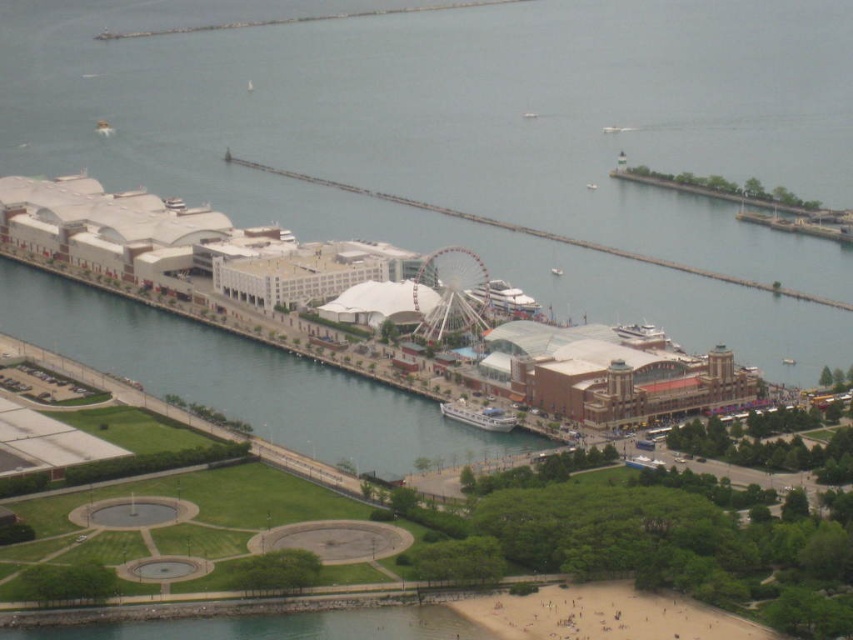
Question: Does green grass at lower center have a lesser width compared to white wooden boat at center?

Choices:
 (A) yes
 (B) no

Answer: (B)

Question: Which object is the closest to the green concrete river at center?

Choices:
 (A) white metallic ferris wheel at center
 (B) green grass at lower center
 (C) white wooden boat at center

Answer: (C)

Question: Is green concrete river at center thinner than white wooden boat at center?

Choices:
 (A) yes
 (B) no

Answer: (B)

Question: Which object is the closest to the white metallic ferris wheel at center?

Choices:
 (A) green grass at lower center
 (B) white wooden boat at center
 (C) green concrete river at center

Answer: (B)

Question: Observing the image, what is the correct spatial positioning of white metallic ferris wheel at center in reference to white wooden boat at center?

Choices:
 (A) right
 (B) left

Answer: (B)

Question: Which point is closer to the camera?

Choices:
 (A) green concrete river at center
 (B) white wooden boat at center

Answer: (A)